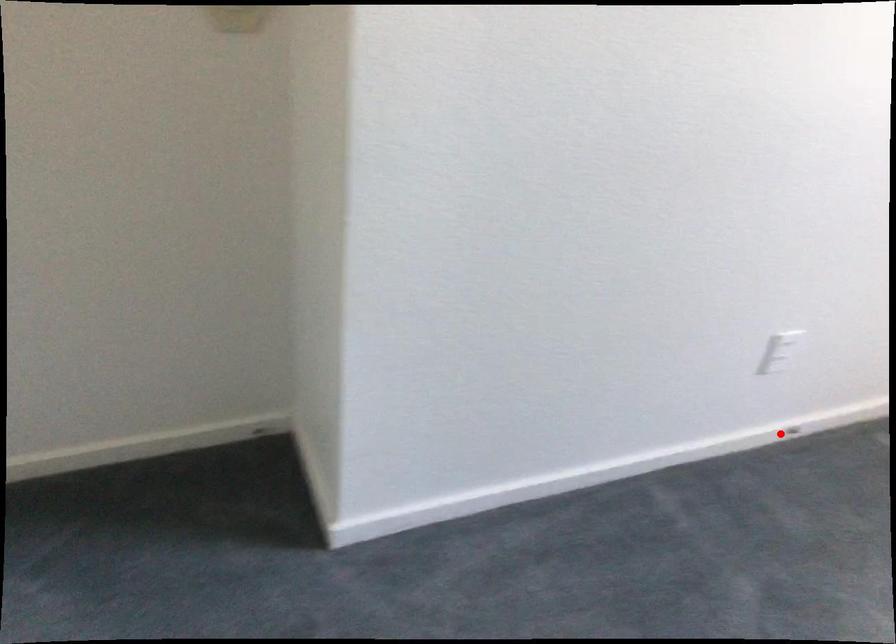
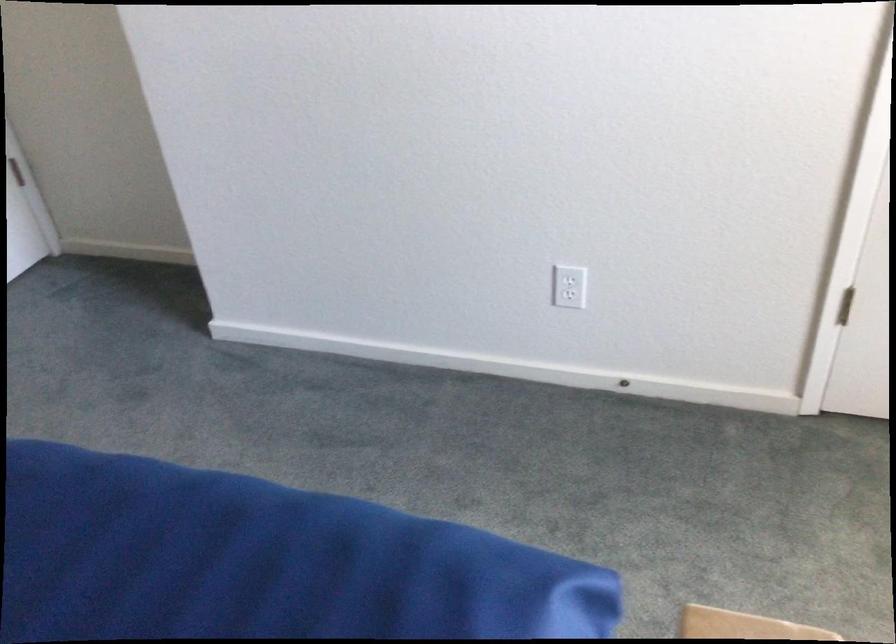
Locate, in the second image, the point that corresponds to the highlighted location in the first image.

(624, 384)